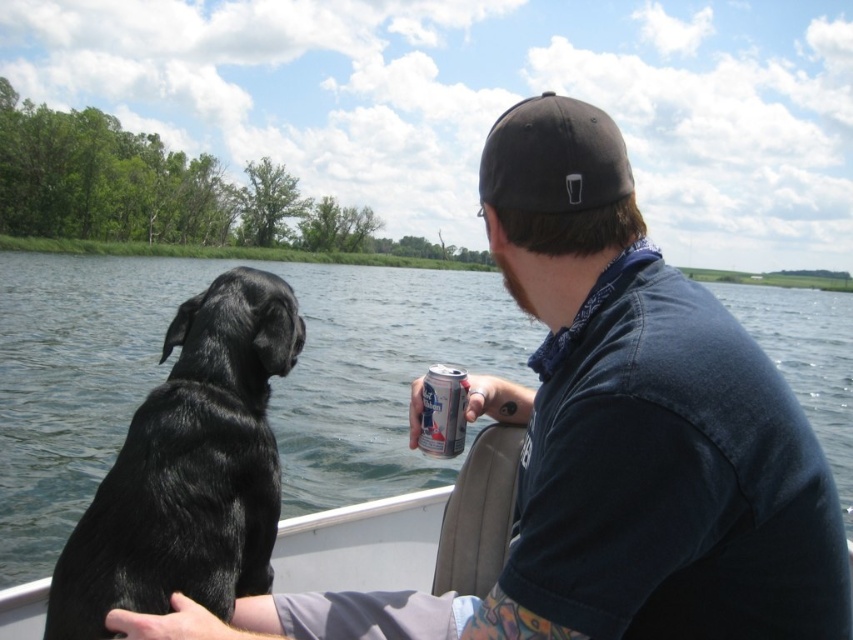
Is black fabric baseball cap at upper center thinner than silver metallic can at center?

In fact, black fabric baseball cap at upper center might be wider than silver metallic can at center.

Is black fabric baseball cap at upper center shorter than silver metallic can at center?

Incorrect, black fabric baseball cap at upper center's height does not fall short of silver metallic can at center's.

The width and height of the screenshot is (853, 640). Describe the element at coordinates (553, 157) in the screenshot. I see `black fabric baseball cap at upper center` at that location.

What are the coordinates of `black fabric baseball cap at upper center` in the screenshot? It's located at [553, 157].

Is black shiny fur dog at left shorter than silver metallic can at center?

No.

Is black shiny fur dog at left positioned at the back of silver metallic can at center?

No, black shiny fur dog at left is closer to the viewer.

Does point (259, 408) come in front of point (437, 417)?

That is True.

The height and width of the screenshot is (640, 853). I want to click on black shiny fur dog at left, so coord(189,468).

Is black shiny fur dog at left taller than black fabric baseball cap at upper center?

Incorrect, black shiny fur dog at left's height is not larger of black fabric baseball cap at upper center's.

Can you confirm if black shiny fur dog at left is positioned below black fabric baseball cap at upper center?

Yes, black shiny fur dog at left is below black fabric baseball cap at upper center.

Locate an element on the screen. The height and width of the screenshot is (640, 853). black shiny fur dog at left is located at coordinates (189, 468).

Identify the location of black shiny fur dog at left. (189, 468).